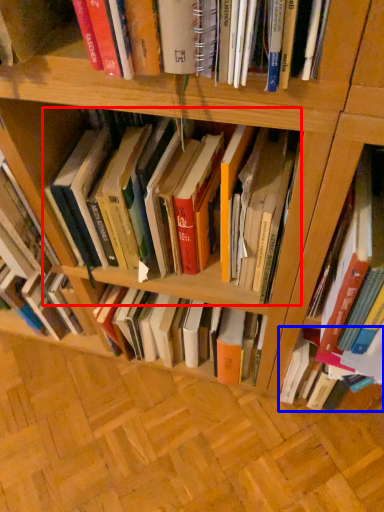
Question: Which object is further to the camera taking this photo, book (highlighted by a red box) or book (highlighted by a blue box)?

Choices:
 (A) book
 (B) book

Answer: (B)